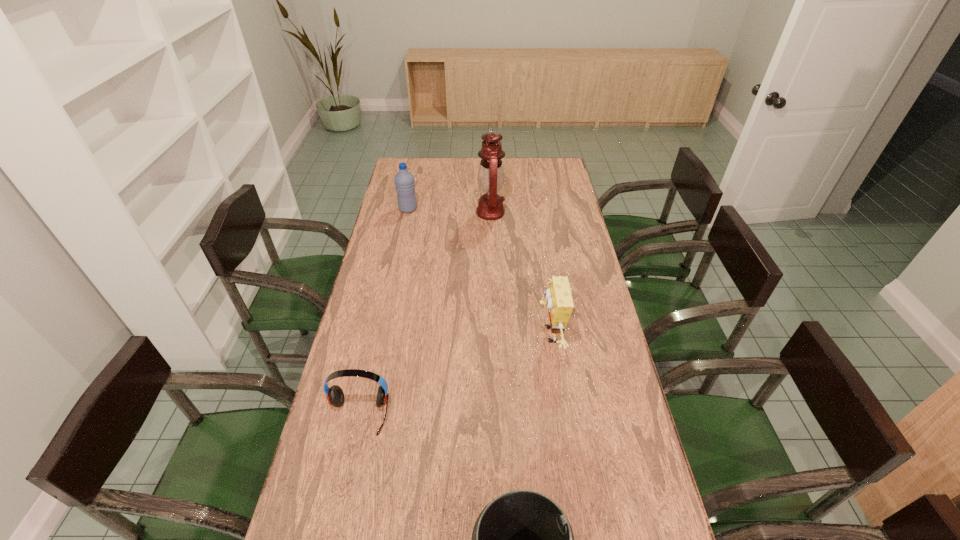
The width and height of the screenshot is (960, 540). I want to click on the tallest object, so click(491, 175).

Identify the location of water bottle. This screenshot has width=960, height=540. (404, 180).

What are the coordinates of `sponge` in the screenshot? It's located at (559, 301).

I want to click on the shortest object, so click(x=335, y=395).

Identify the location of the fourth farthest object. (335, 395).

The image size is (960, 540). In order to click on vacant space located 0.200m on the front of the tallest object in this screenshot , I will do `click(492, 255)`.

Where is `free space located 0.390m on the front of the water bottle`? The width and height of the screenshot is (960, 540). free space located 0.390m on the front of the water bottle is located at coordinates (395, 274).

Identify the location of free spot located on the face of the sponge. The width and height of the screenshot is (960, 540). pos(511,335).

The image size is (960, 540). What are the coordinates of `free location located on the face of the sponge` in the screenshot? It's located at (471, 335).

You are a GUI agent. You are given a task and a screenshot of the screen. Output one action in this format:
    pyautogui.click(x=<x>, y=<y>)
    Task: Click on the free space located 0.180m on the face of the sponge
    Image resolution: width=960 pixels, height=540 pixels.
    Given the screenshot: What is the action you would take?
    pyautogui.click(x=480, y=335)